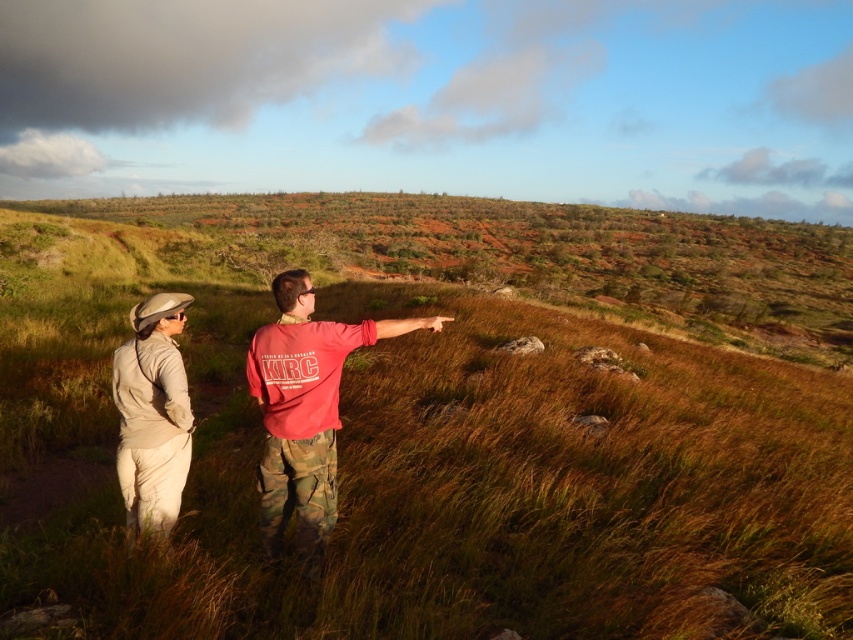
Question: Which point is farther to the camera?

Choices:
 (A) beige fabric jacket at lower left
 (B) brown grassy hillside at center
 (C) red matte shirt at center
 (D) brown grass at center

Answer: (B)

Question: Is brown grass at center to the left of red matte shirt at center from the viewer's perspective?

Choices:
 (A) yes
 (B) no

Answer: (A)

Question: Does brown grass at center have a larger size compared to brown grassy hillside at center?

Choices:
 (A) yes
 (B) no

Answer: (B)

Question: Among these points, which one is nearest to the camera?

Choices:
 (A) (123, 440)
 (B) (268, 362)
 (C) (361, 241)
 (D) (543, 220)

Answer: (A)

Question: Which object is farther from the camera taking this photo?

Choices:
 (A) red matte shirt at center
 (B) brown grassy hillside at center

Answer: (B)

Question: Does red matte shirt at center appear on the right side of beige fabric jacket at lower left?

Choices:
 (A) no
 (B) yes

Answer: (B)